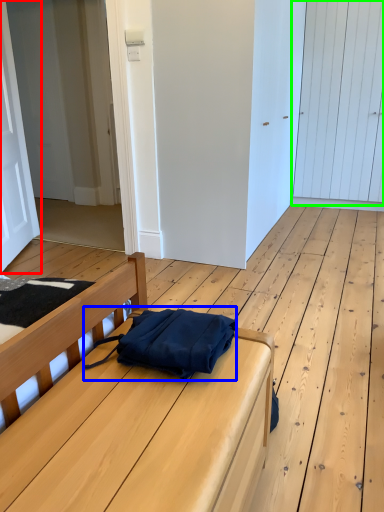
Question: Which object is positioned farthest from door (highlighted by a red box)? Select from messenger bag (highlighted by a blue box) and door (highlighted by a green box).

Choices:
 (A) messenger bag
 (B) door

Answer: (B)